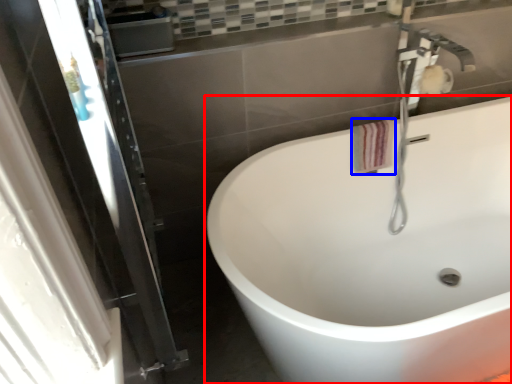
Question: Which of the following is the closest to the observer, bathtub (highlighted by a red box) or hand towel (highlighted by a blue box)?

Choices:
 (A) bathtub
 (B) hand towel

Answer: (A)